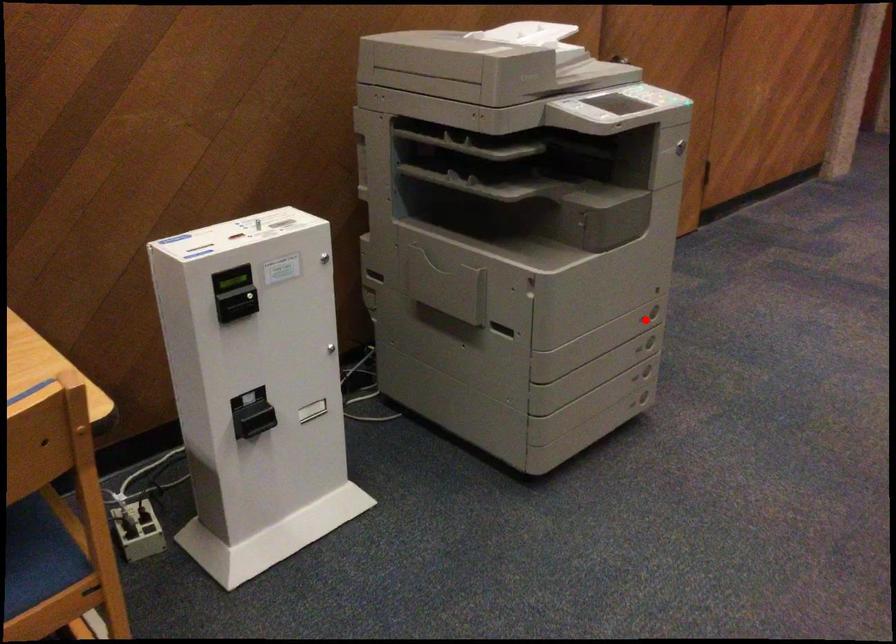
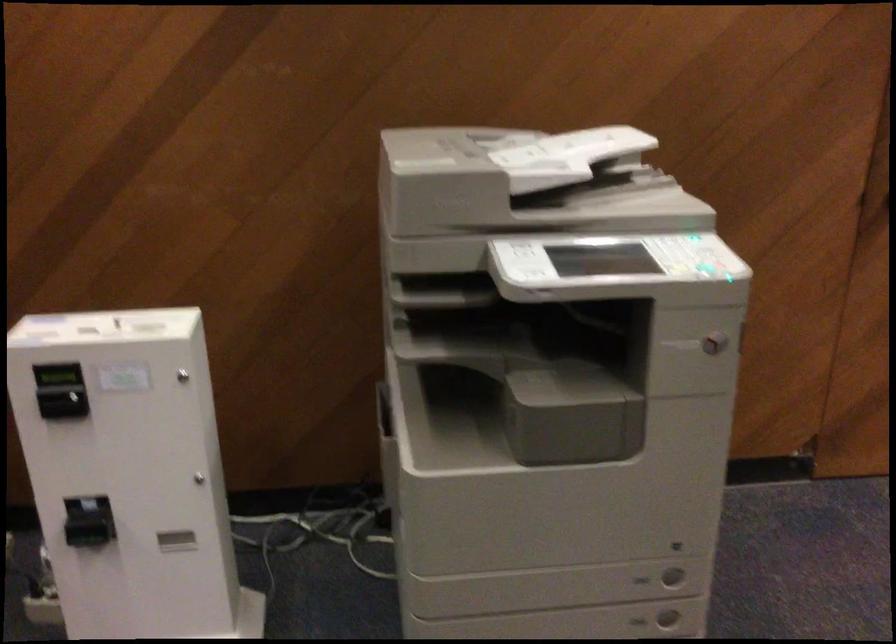
Where in the second image is the point corresponding to the highlighted location from the first image?

(642, 580)